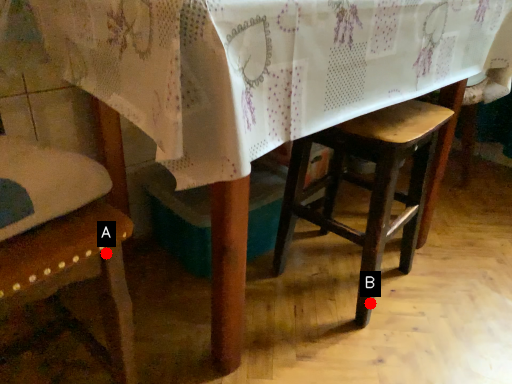
Question: Two points are circled on the image, labeled by A and B beside each circle. Which of the following is the closest to the observer?

Choices:
 (A) A is closer
 (B) B is closer

Answer: (A)